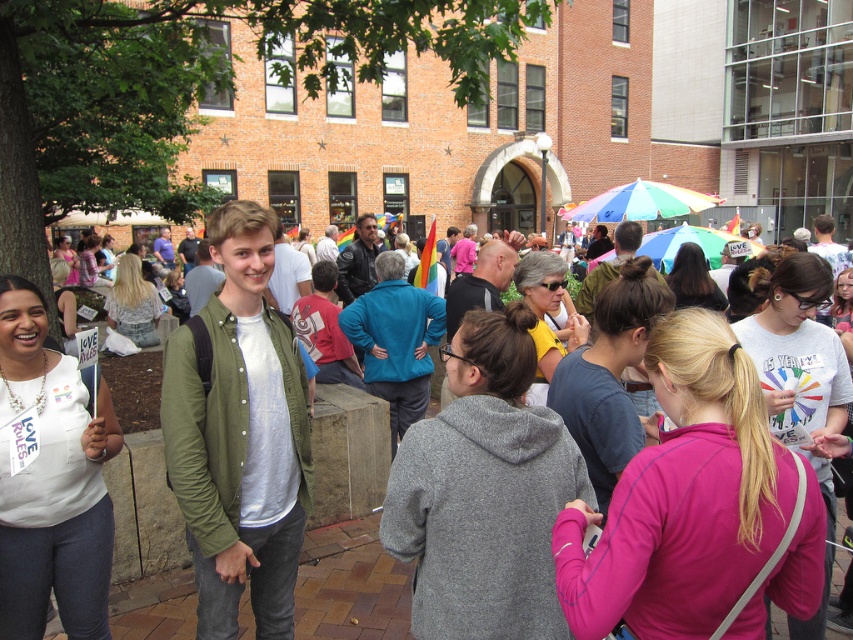
Is green matte jacket at center bigger than yellow matte shirt at center?

No, green matte jacket at center is not bigger than yellow matte shirt at center.

Who is more forward, (225, 496) or (570, 349)?

Point (225, 496) is more forward.

The image size is (853, 640). I want to click on green matte jacket at center, so tap(239, 435).

The image size is (853, 640). In order to click on green matte jacket at center in this screenshot , I will do `click(239, 435)`.

Which is behind, point (204, 444) or point (704, 285)?

The point (704, 285) is more distant.

This screenshot has width=853, height=640. In order to click on green matte jacket at center in this screenshot , I will do `click(239, 435)`.

Which of these two, dark brown hair at center or matte pink dress at center, stands taller?

matte pink dress at center

Can you confirm if dark brown hair at center is taller than matte pink dress at center?

In fact, dark brown hair at center may be shorter than matte pink dress at center.

I want to click on dark brown hair at center, so click(x=693, y=280).

Locate an element on the screen. The height and width of the screenshot is (640, 853). dark brown hair at center is located at coordinates click(x=693, y=280).